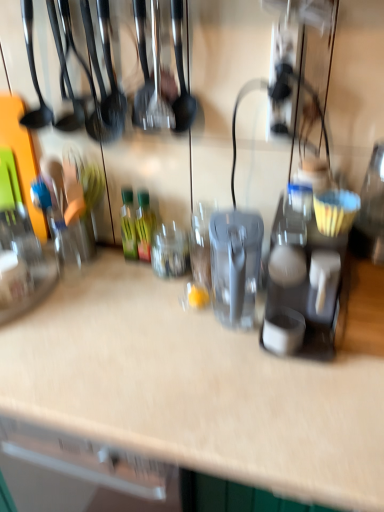
You are a GUI agent. You are given a task and a screenshot of the screen. Output one action in this format:
    pyautogui.click(x=<x>, y=<y>)
    Task: Click on the free space in front of matte gray coffee maker at center right
    
    Given the screenshot: What is the action you would take?
    pyautogui.click(x=299, y=394)